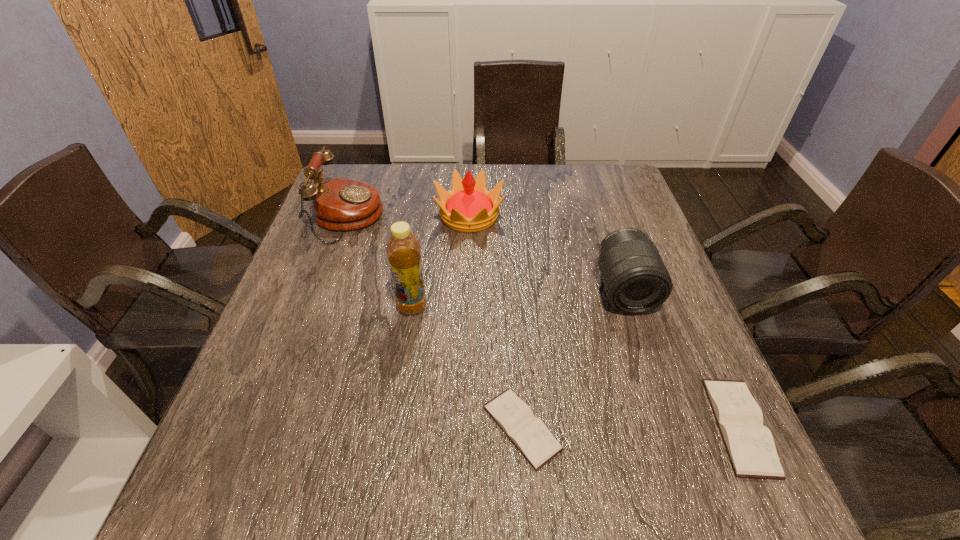
What are the coordinates of `unoccupied area between the bottle and the shortest object` in the screenshot? It's located at (467, 367).

Locate an element on the screen. Image resolution: width=960 pixels, height=540 pixels. free area in between the crown and the leftmost object is located at coordinates (409, 217).

You are a GUI agent. You are given a task and a screenshot of the screen. Output one action in this format:
    pyautogui.click(x=<x>, y=<y>)
    Task: Click on the free space between the leftmost object and the right diary
    This screenshot has width=960, height=540.
    Given the screenshot: What is the action you would take?
    pyautogui.click(x=543, y=322)

The height and width of the screenshot is (540, 960). I want to click on empty space between the taller diary and the telephone, so click(543, 322).

Identify the location of free space between the bottle and the taller diary. Image resolution: width=960 pixels, height=540 pixels. (576, 366).

You are a GUI agent. You are given a task and a screenshot of the screen. Output one action in this format:
    pyautogui.click(x=<x>, y=<y>)
    Task: Click on the vacant point located between the fifth object from left to right and the shortest object
    This screenshot has height=540, width=960.
    Given the screenshot: What is the action you would take?
    pyautogui.click(x=573, y=359)

Where is `vacant area between the shortest object and the crown`? The image size is (960, 540). vacant area between the shortest object and the crown is located at coordinates (495, 322).

Locate an element on the screen. This screenshot has height=540, width=960. free area in between the leftmost object and the shortest object is located at coordinates (435, 323).

This screenshot has width=960, height=540. I want to click on the second closest object relative to the leftmost object, so click(x=403, y=249).

Where is `object that stands as the closest to the telephone`? The image size is (960, 540). object that stands as the closest to the telephone is located at coordinates (468, 207).